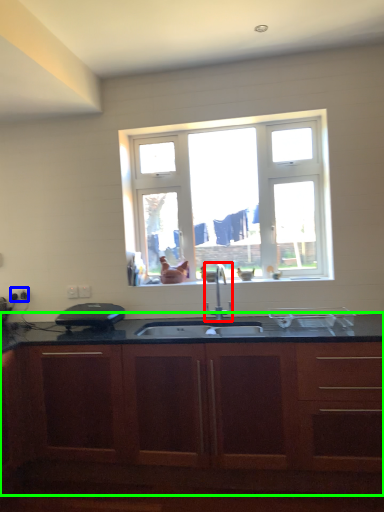
Question: Based on their relative distances, which object is nearer to tap (highlighted by a red box)? Choose from electric outlet (highlighted by a blue box) and cabinetry (highlighted by a green box).

Choices:
 (A) electric outlet
 (B) cabinetry

Answer: (B)